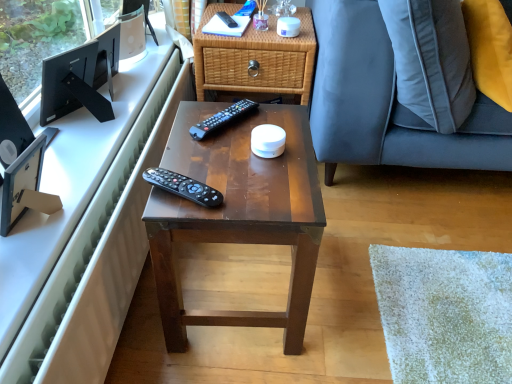
Question: Does white glossy computer desk at upper left have a lesser height compared to black plastic remote control at upper center, which appears as the 3th remote control when viewed from the front?

Choices:
 (A) yes
 (B) no

Answer: (B)

Question: Is white glossy computer desk at upper left smaller than black plastic remote control at upper center, which ranks as the 3th remote control in bottom-to-top order?

Choices:
 (A) yes
 (B) no

Answer: (B)

Question: Is white glossy computer desk at upper left not near black plastic remote control at upper center, which appears as the 3th remote control when viewed from the front?

Choices:
 (A) no
 (B) yes

Answer: (A)

Question: Is black plastic remote control at upper center, which is the first remote control in back-to-front order, surrounded by white glossy computer desk at upper left?

Choices:
 (A) yes
 (B) no

Answer: (B)

Question: Is black plastic remote control at upper center, which is counted as the 1th remote control, starting from the top, at the back of white glossy computer desk at upper left?

Choices:
 (A) no
 (B) yes

Answer: (A)

Question: From a real-world perspective, is black matte monitor at upper left, marked as the first television in a back-to-front arrangement, above or below black plastic remote control at upper center, which ranks as the 3th remote control in bottom-to-top order?

Choices:
 (A) above
 (B) below

Answer: (B)

Question: In the image, is black matte monitor at upper left, which is the 1th television in top-to-bottom order, positioned in front of or behind black plastic remote control at upper center, which is counted as the 1th remote control, starting from the top?

Choices:
 (A) behind
 (B) front

Answer: (B)

Question: In the image, is black matte monitor at upper left, placed as the second television when sorted from front to back, on the left side or the right side of black plastic remote control at upper center, which appears as the 3th remote control when viewed from the front?

Choices:
 (A) left
 (B) right

Answer: (A)

Question: From the image's perspective, is black matte monitor at upper left, marked as the first television in a back-to-front arrangement, above or below black plastic remote control at upper center, which is the first remote control in back-to-front order?

Choices:
 (A) above
 (B) below

Answer: (B)

Question: Is black plastic remote control at center, which appears as the second remote control when viewed from the back, bigger or smaller than black matte monitor at upper left, the second television when ordered from bottom to top?

Choices:
 (A) small
 (B) big

Answer: (A)

Question: Is point (215, 125) closer or farther from the camera than point (60, 59)?

Choices:
 (A) farther
 (B) closer

Answer: (B)

Question: In terms of width, does black plastic remote control at center, which ranks as the second remote control in top-to-bottom order, look wider or thinner when compared to black matte monitor at upper left, the second television when ordered from bottom to top?

Choices:
 (A) thin
 (B) wide

Answer: (A)

Question: Is black plastic remote control at center, which appears as the second remote control when viewed from the front, inside the boundaries of black matte monitor at upper left, which is the 1th television in top-to-bottom order, or outside?

Choices:
 (A) inside
 (B) outside

Answer: (B)

Question: Is black plastic remote control at center, which is the first remote control in front-to-back order, bigger or smaller than black plastic remote control at center, which ranks as the second remote control in top-to-bottom order?

Choices:
 (A) small
 (B) big

Answer: (A)

Question: Considering the positions of black plastic remote control at center, the 3th remote control from the back, and black plastic remote control at center, which ranks as the second remote control in top-to-bottom order, in the image, is black plastic remote control at center, the 3th remote control from the back, taller or shorter than black plastic remote control at center, which ranks as the second remote control in top-to-bottom order,?

Choices:
 (A) short
 (B) tall

Answer: (B)